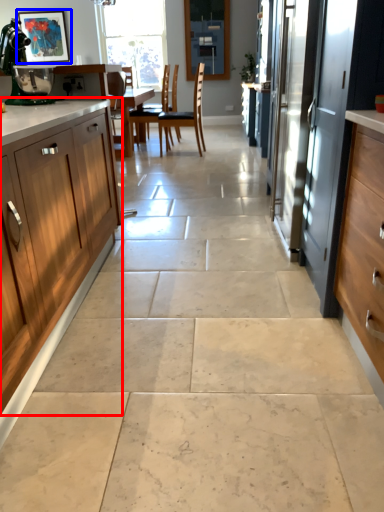
Question: Among these objects, which one is nearest to the camera, cabinetry (highlighted by a red box) or picture frame (highlighted by a blue box)?

Choices:
 (A) cabinetry
 (B) picture frame

Answer: (A)